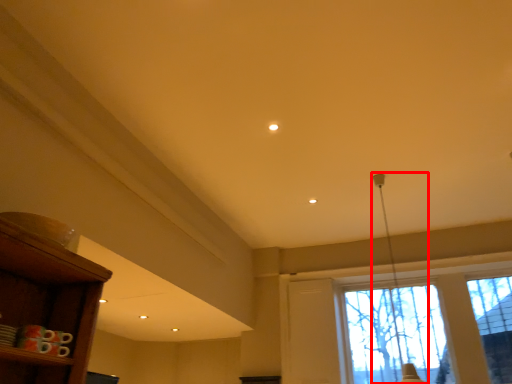
Question: From the image's perspective, what is the correct spatial positioning of lamp (annotated by the red box) in reference to window?

Choices:
 (A) below
 (B) above

Answer: (B)